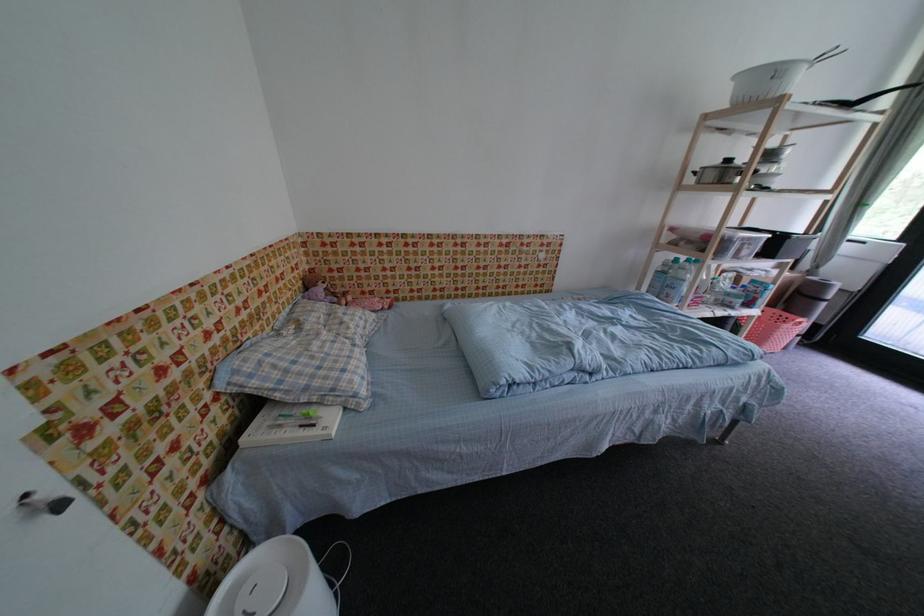
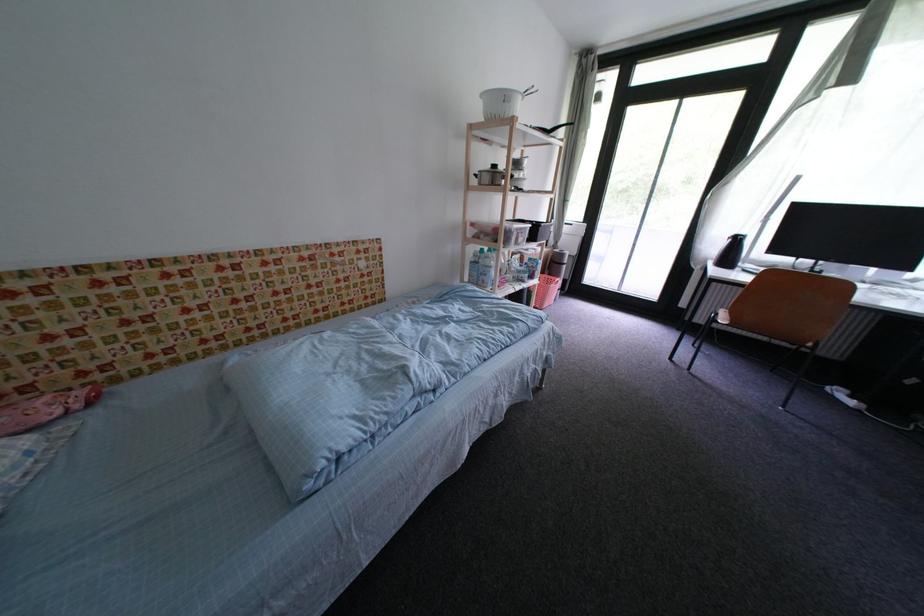
Locate, in the second image, the point that corresponds to (744,79) in the first image.

(490, 98)